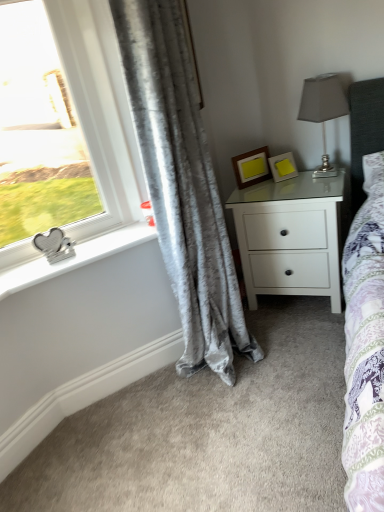
Where is `free space above white matte nightstand at center-right (from a real-world perspective)`? This screenshot has width=384, height=512. free space above white matte nightstand at center-right (from a real-world perspective) is located at coordinates (294, 175).